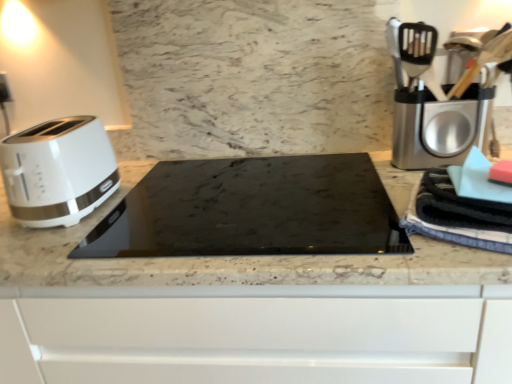
Question: Is point (239, 241) closer or farther from the camera than point (113, 175)?

Choices:
 (A) farther
 (B) closer

Answer: (B)

Question: Is black glass cooktop at center taller or shorter than white glossy toaster at left?

Choices:
 (A) tall
 (B) short

Answer: (B)

Question: Which is nearer to the black glass cooktop at center?

Choices:
 (A) blue striped towel at right
 (B) marble at center
 (C) silver metallic coffee machine at right
 (D) white glossy toaster at left

Answer: (B)

Question: Estimate the real-world distances between objects in this image. Which object is farther from the white glossy toaster at left?

Choices:
 (A) marble at center
 (B) blue striped towel at right
 (C) silver metallic coffee machine at right
 (D) black glass cooktop at center

Answer: (C)